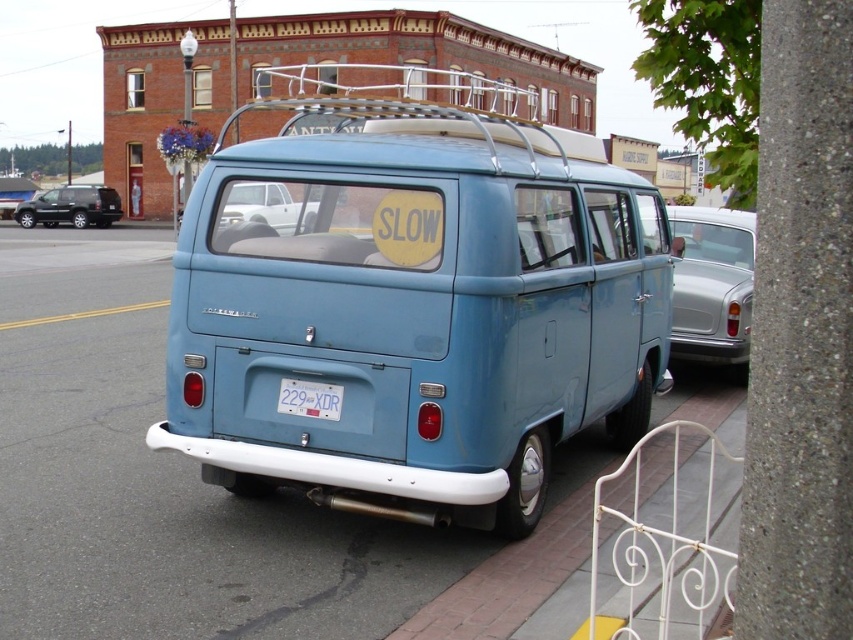
Question: Can you confirm if matte blue van at center is positioned to the left of brick sidewalk at lower right?

Choices:
 (A) no
 (B) yes

Answer: (B)

Question: Which object appears closest to the camera in this image?

Choices:
 (A) matte blue van at center
 (B) white plastic license plate at center
 (C) brick sidewalk at lower right
 (D) metallic silver sedan at right

Answer: (C)

Question: Is matte black minivan at left smaller than white plastic license plate at center?

Choices:
 (A) yes
 (B) no

Answer: (B)

Question: Which object is positioned farthest from the smooth asphalt pavement at center?

Choices:
 (A) matte blue van at center
 (B) brick sidewalk at lower right

Answer: (A)

Question: Which object is farther from the camera taking this photo?

Choices:
 (A) matte blue van at center
 (B) metallic silver sedan at right
 (C) white plastic license plate at center
 (D) brick sidewalk at lower right

Answer: (B)

Question: From the image, what is the correct spatial relationship of brick sidewalk at lower right in relation to white plastic license plate at center?

Choices:
 (A) above
 (B) below

Answer: (B)